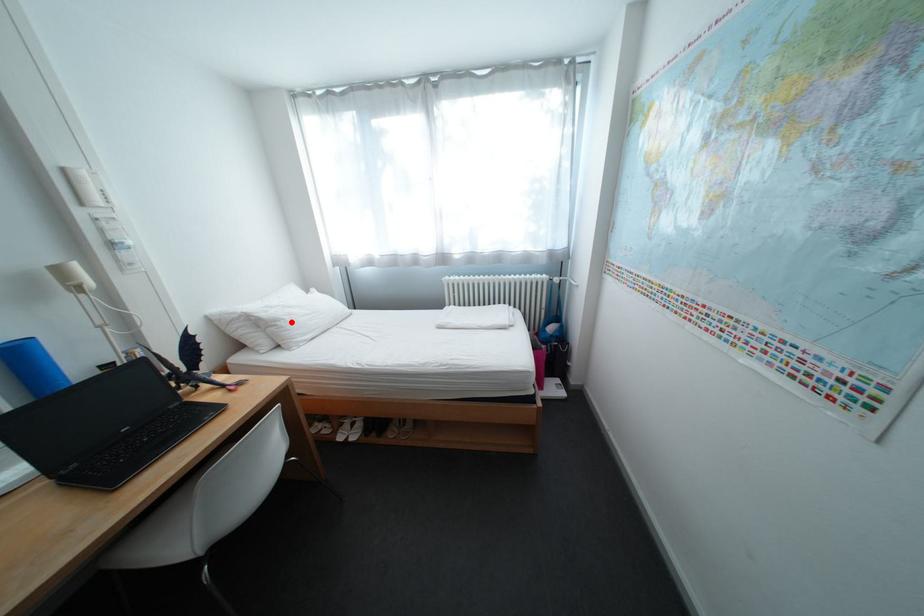
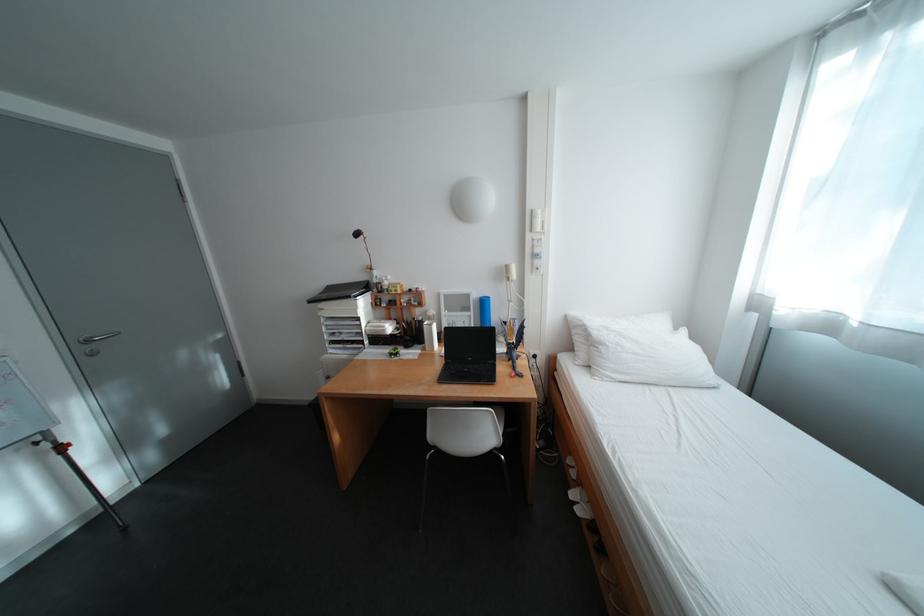
Question: I am providing you with two images of the same scene from different viewpoints. In image1, a red point is highlighted. Considering the same 3D point in image2, which of the following is correct?

Choices:
 (A) It is closer
 (B) It is farther

Answer: (B)